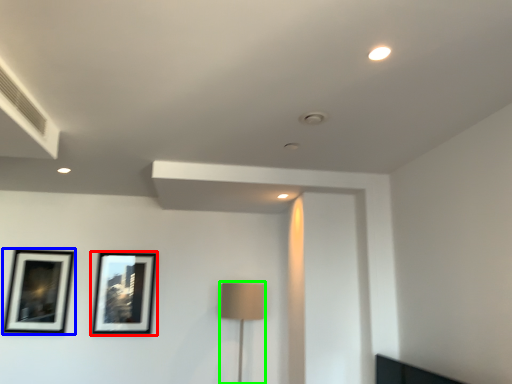
Question: Based on their relative distances, which object is farther from picture frame (highlighted by a red box)? Choose from picture frame (highlighted by a blue box) and table lamp (highlighted by a green box).

Choices:
 (A) picture frame
 (B) table lamp

Answer: (B)